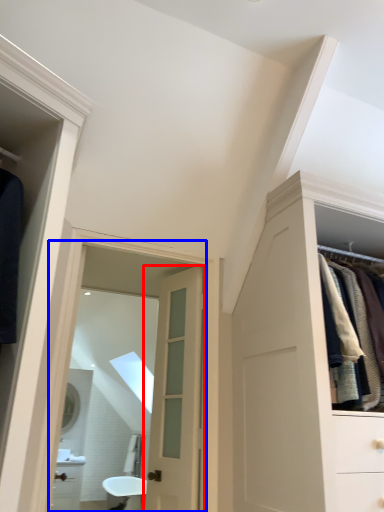
Question: Which of the following is the closest to the observer, door (highlighted by a red box) or mirror (highlighted by a blue box)?

Choices:
 (A) door
 (B) mirror

Answer: (B)